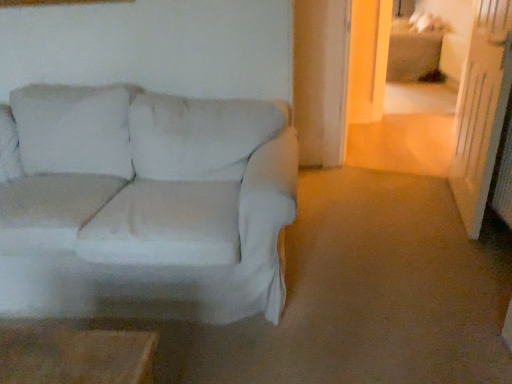
Question: Can you confirm if transparent glass door at right is bigger than white fabric couch at left?

Choices:
 (A) no
 (B) yes

Answer: (A)

Question: Considering the relative sizes of transparent glass door at right and white fabric couch at left in the image provided, is transparent glass door at right wider than white fabric couch at left?

Choices:
 (A) yes
 (B) no

Answer: (B)

Question: Is transparent glass door at right at the left side of white fabric couch at left?

Choices:
 (A) no
 (B) yes

Answer: (A)

Question: Are transparent glass door at right and white fabric couch at left located far from each other?

Choices:
 (A) no
 (B) yes

Answer: (B)

Question: From a real-world perspective, is transparent glass door at right located higher than white fabric couch at left?

Choices:
 (A) yes
 (B) no

Answer: (A)

Question: Is transparent glass door at right positioned beyond the bounds of white fabric couch at left?

Choices:
 (A) yes
 (B) no

Answer: (A)

Question: Does white fabric couch at left lie behind transparent glass door at right?

Choices:
 (A) yes
 (B) no

Answer: (B)

Question: Are white fabric couch at left and transparent glass door at right beside each other?

Choices:
 (A) no
 (B) yes

Answer: (A)

Question: Considering the relative sizes of white fabric couch at left and transparent glass door at right in the image provided, is white fabric couch at left smaller than transparent glass door at right?

Choices:
 (A) yes
 (B) no

Answer: (B)

Question: Is white fabric couch at left facing towards transparent glass door at right?

Choices:
 (A) yes
 (B) no

Answer: (B)

Question: Does white fabric couch at left have a greater height compared to transparent glass door at right?

Choices:
 (A) yes
 (B) no

Answer: (B)

Question: Considering the relative positions of white fabric couch at left and transparent glass door at right in the image provided, is white fabric couch at left to the right of transparent glass door at right from the viewer's perspective?

Choices:
 (A) yes
 (B) no

Answer: (B)

Question: Choose the correct answer: Is transparent glass door at right inside white fabric couch at left or outside it?

Choices:
 (A) inside
 (B) outside

Answer: (B)